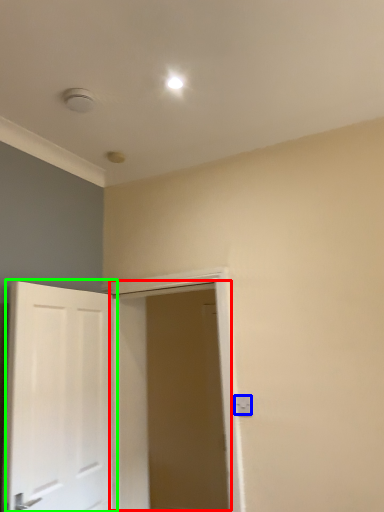
Question: Based on their relative distances, which object is nearer to door (highlighted by a red box)? Choose from electric outlet (highlighted by a blue box) and door (highlighted by a green box).

Choices:
 (A) electric outlet
 (B) door

Answer: (B)